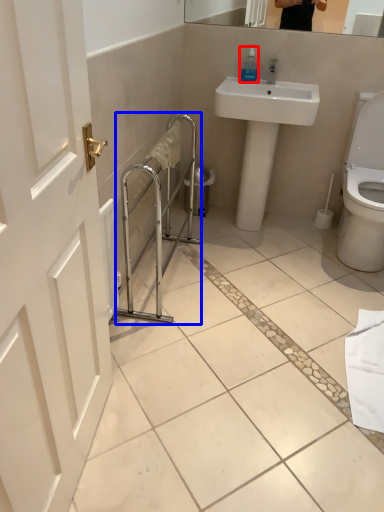
Question: Among these objects, which one is nearest to the camera, soap dispenser (highlighted by a red box) or balustrade (highlighted by a blue box)?

Choices:
 (A) soap dispenser
 (B) balustrade

Answer: (B)